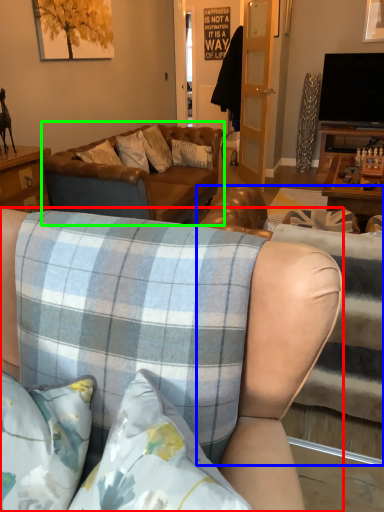
Question: Which object is the farthest from studio couch (highlighted by a red box)? Choose among these: studio couch (highlighted by a blue box) or studio couch (highlighted by a green box).

Choices:
 (A) studio couch
 (B) studio couch

Answer: (B)